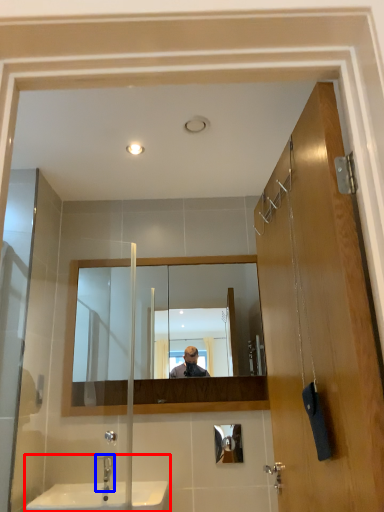
Question: Which object is further to the camera taking this photo, sink (highlighted by a red box) or tap (highlighted by a blue box)?

Choices:
 (A) sink
 (B) tap

Answer: (B)